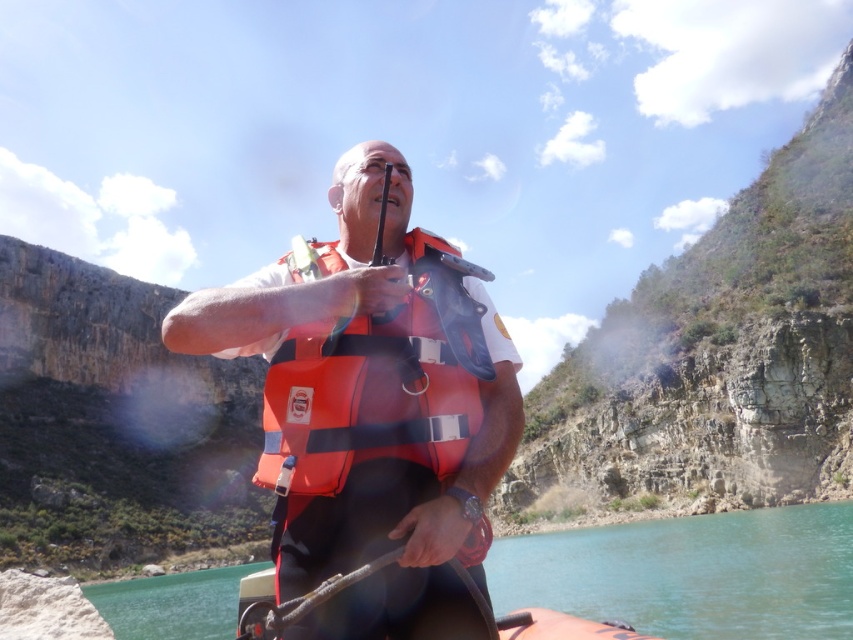
Is orange life vest at center to the left of clear water at lower center from the viewer's perspective?

No, orange life vest at center is not to the left of clear water at lower center.

What do you see at coordinates (368, 413) in the screenshot?
I see `orange life vest at center` at bounding box center [368, 413].

The height and width of the screenshot is (640, 853). I want to click on orange life vest at center, so click(x=368, y=413).

Where is `clear water at lower center`? This screenshot has width=853, height=640. clear water at lower center is located at coordinates click(692, 573).

Is point (704, 612) positioned after point (421, 236)?

That is True.

Image resolution: width=853 pixels, height=640 pixels. Describe the element at coordinates (692, 573) in the screenshot. I see `clear water at lower center` at that location.

Locate an element on the screen. clear water at lower center is located at coordinates (692, 573).

Is orange life vest at center above orange fabric life vest at center?

Correct, orange life vest at center is located above orange fabric life vest at center.

Is orange life vest at center thinner than orange fabric life vest at center?

In fact, orange life vest at center might be wider than orange fabric life vest at center.

What are the coordinates of `orange life vest at center` in the screenshot? It's located at (368, 413).